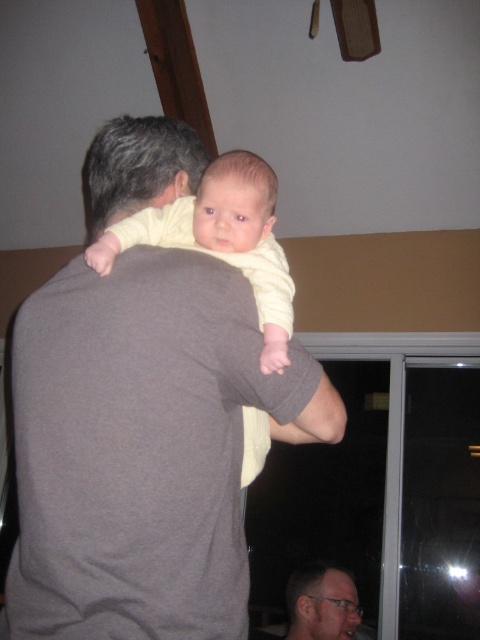
Is yellow soft fabric baby at center bigger than matte gray shirt at center?

Correct, yellow soft fabric baby at center is larger in size than matte gray shirt at center.

Where is `yellow soft fabric baby at center`? The width and height of the screenshot is (480, 640). yellow soft fabric baby at center is located at coordinates (223, 240).

Find the location of a particular element. The height and width of the screenshot is (640, 480). yellow soft fabric baby at center is located at coordinates (223, 240).

In the scene shown: Who is more distant from viewer, (60, 371) or (327, 620)?

Positioned behind is point (327, 620).

Locate an element on the screen. gray cotton shirt at upper left is located at coordinates (143, 445).

Is gray cotton shirt at upper left to the right of yellow soft fabric baby at center from the viewer's perspective?

Incorrect, gray cotton shirt at upper left is not on the right side of yellow soft fabric baby at center.

Can you confirm if gray cotton shirt at upper left is smaller than yellow soft fabric baby at center?

No.

At what (x,y) coordinates should I click in order to perform the action: click on gray cotton shirt at upper left. Please return your answer as a coordinate pair (x, y). Looking at the image, I should click on (143, 445).